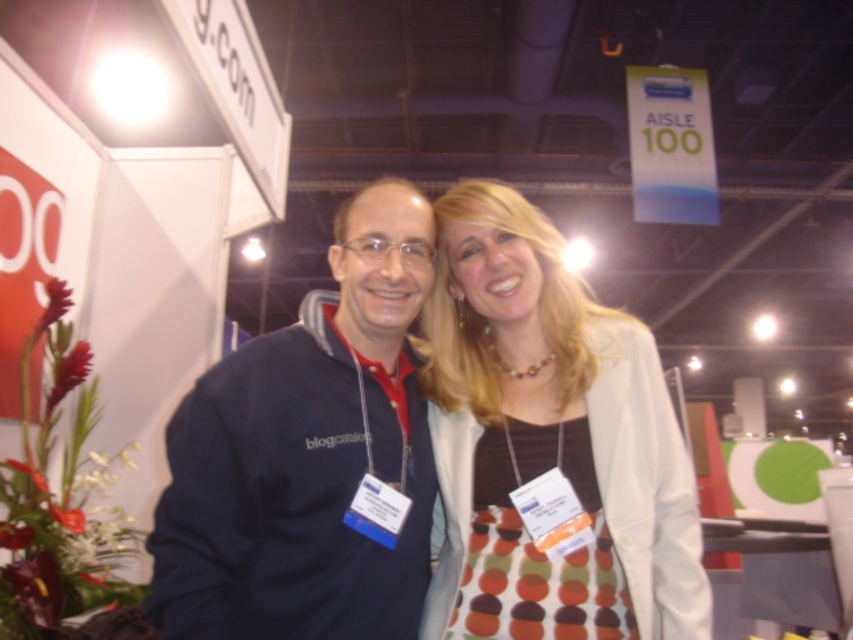
Question: Which point is closer to the camera?

Choices:
 (A) polka dot fabric dress at center
 (B) dark blue fleece at center

Answer: (B)

Question: Is polka dot fabric dress at center above dark blue fleece at center?

Choices:
 (A) no
 (B) yes

Answer: (A)

Question: Among these points, which one is farthest from the camera?

Choices:
 (A) pyautogui.click(x=322, y=324)
 (B) pyautogui.click(x=584, y=476)

Answer: (A)

Question: From the image, what is the correct spatial relationship of polka dot fabric dress at center in relation to dark blue fleece at center?

Choices:
 (A) right
 (B) left

Answer: (A)

Question: Does polka dot fabric dress at center appear over dark blue fleece at center?

Choices:
 (A) yes
 (B) no

Answer: (B)